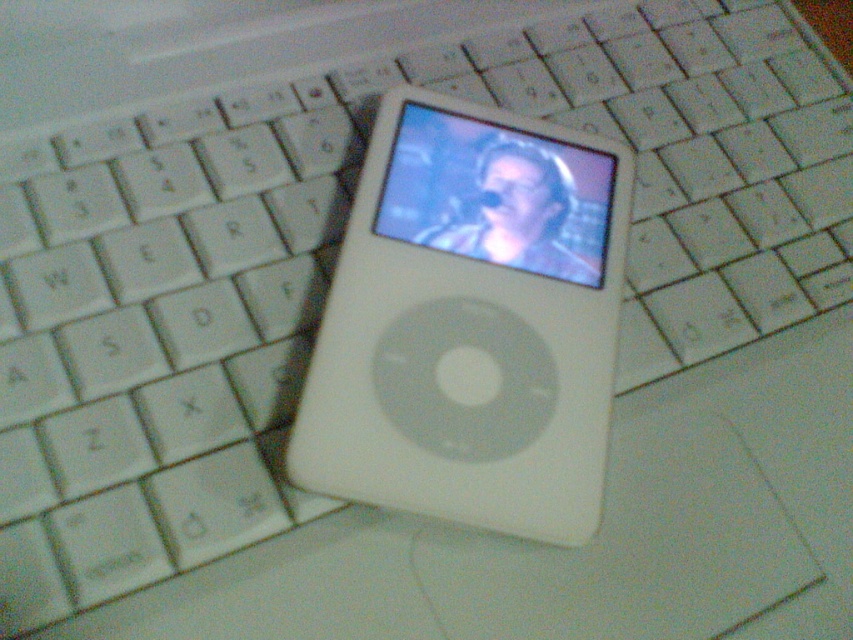
You need to place a protective cover designed for the matte plastic screen at center onto the white plastic ipod at center. Will the cover fit properly?

→ The white plastic ipod at center is bigger than the matte plastic screen at center. Since the protective cover is designed for the screen, it will not fit properly on the larger iPod.

You are trying to locate the white plastic ipod at center in the image. What are the coordinates where you can find it?

The white plastic ipod at center can be found at coordinates point (469, 323).

You are trying to locate a specific point on the white iPod classic displayed in the image. The point is identified as point (x=469, y=323). Based on the scene description, where exactly on the iPod classic would this point be located?

The point (x=469, y=323) is located on the white plastic iPod at center, which has a circular navigation control in the center. Since the point coordinates are given as fractions, it likely corresponds to the central area of the iPod, possibly near the circular navigation control.